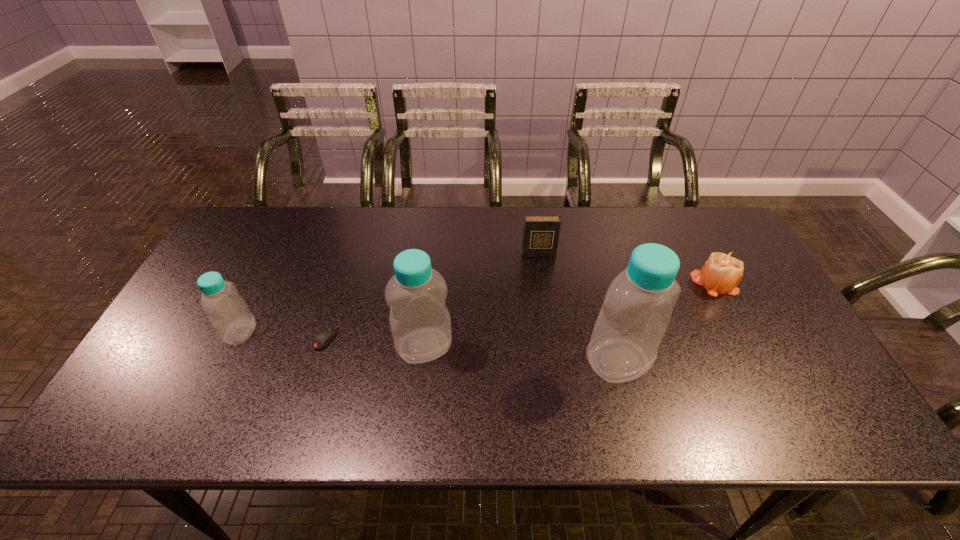
In order to click on object at the right edge in this screenshot , I will do `click(722, 272)`.

The image size is (960, 540). Find the location of `vacant region at the far edge of the desktop`. vacant region at the far edge of the desktop is located at coordinates (429, 206).

Identify the location of vacant region at the near edge of the desktop. The image size is (960, 540). (564, 400).

At what (x,y) coordinates should I click in order to perform the action: click on vacant region at the right edge. Please return your answer as a coordinate pair (x, y). Looking at the image, I should click on (746, 272).

I want to click on vacant space at the far left corner of the desktop, so click(x=269, y=217).

This screenshot has height=540, width=960. In order to click on free space at the near left corner of the desktop in this screenshot , I will do pyautogui.click(x=132, y=388).

In the image, there is a desktop. Identify the location of vacant space at the far right corner. The height and width of the screenshot is (540, 960). (717, 239).

Where is `free space between the farthest object and the second tallest bottle`? The image size is (960, 540). free space between the farthest object and the second tallest bottle is located at coordinates (481, 300).

Where is `vacant space that is in between the farthest object and the third object from left to right`? vacant space that is in between the farthest object and the third object from left to right is located at coordinates (481, 300).

Identify the location of free space between the computer mouse and the fifth shortest object. This screenshot has height=540, width=960. (374, 342).